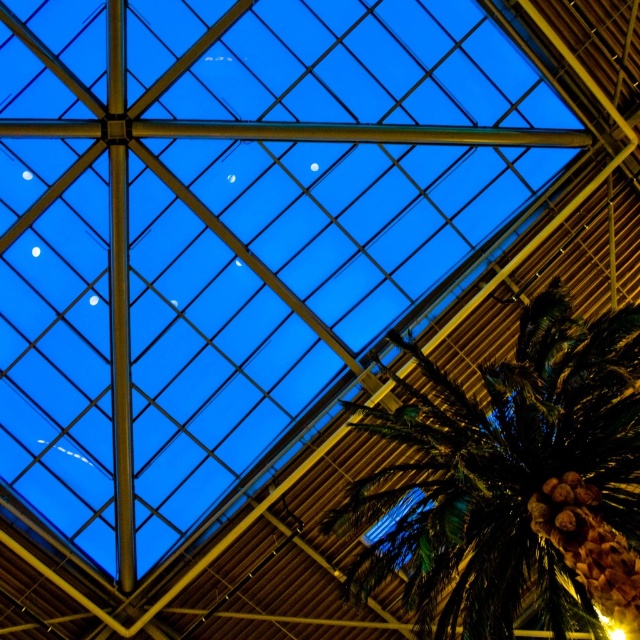
In the scene shown: You are standing in the modern building and want to pick up the brown matte pine cone at lower right. Is the green leafy palm tree at lower right blocking your direct path to it?

The green leafy palm tree at lower right is in front of the brown matte pine cone at lower right, so the palm tree is blocking the direct path to the pine cone.

You are standing at the entrance of the modern building and want to find the green leafy palm tree at lower right. According to the coordinates provided, where should you look to locate it?

The green leafy palm tree at lower right is located at point (512, 481), so you should look towards the lower right area of the image to find it.

You are standing in the modern building and want to place a small decorative item between the green leafy palm tree at lower right and the brown matte pine cone at lower right. Which side of the pine cone should you place it on?

You should place the decorative item to the left side of the brown matte pine cone at lower right because the green leafy palm tree at lower right is already positioned to its left.